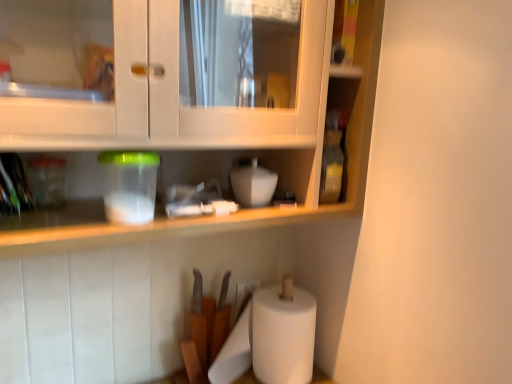
Question: Can you confirm if white matte bowl at center, acting as the 2th appliance starting from the front, is taller than translucent plastic container at upper left, which ranks as the first appliance in left-to-right order?

Choices:
 (A) yes
 (B) no

Answer: (B)

Question: Is the position of white matte bowl at center, which is the first appliance in right-to-left order, less distant than that of translucent plastic container at upper left, which ranks as the first appliance in left-to-right order?

Choices:
 (A) no
 (B) yes

Answer: (A)

Question: Can you confirm if white matte bowl at center, positioned as the 1th appliance in back-to-front order, is shorter than translucent plastic container at upper left, which is the 1th appliance in front-to-back order?

Choices:
 (A) yes
 (B) no

Answer: (A)

Question: Is white matte bowl at center, which is the first appliance in right-to-left order, positioned beyond the bounds of translucent plastic container at upper left, which ranks as the first appliance in left-to-right order?

Choices:
 (A) yes
 (B) no

Answer: (A)

Question: Considering the relative sizes of white matte bowl at center, positioned as the 1th appliance in back-to-front order, and translucent plastic container at upper left, which is the 1th appliance in front-to-back order, in the image provided, is white matte bowl at center, positioned as the 1th appliance in back-to-front order, bigger than translucent plastic container at upper left, which is the 1th appliance in front-to-back order,?

Choices:
 (A) no
 (B) yes

Answer: (A)

Question: From a real-world perspective, is translucent plastic container at upper left, which ranks as the first appliance in left-to-right order, physically above white matte bowl at center, which is the first appliance in right-to-left order?

Choices:
 (A) no
 (B) yes

Answer: (B)

Question: Could you tell me if translucent plastic container at upper left, which is the 1th appliance in front-to-back order, is facing white matte bowl at center, which appears as the second appliance when viewed from the left?

Choices:
 (A) no
 (B) yes

Answer: (A)

Question: From a real-world perspective, is translucent plastic container at upper left, which is the 1th appliance in front-to-back order, located beneath white matte bowl at center, acting as the 2th appliance starting from the front?

Choices:
 (A) no
 (B) yes

Answer: (A)

Question: Is translucent plastic container at upper left, which ranks as the first appliance in left-to-right order, closer to camera compared to white matte bowl at center, acting as the 2th appliance starting from the front?

Choices:
 (A) no
 (B) yes

Answer: (B)

Question: Is translucent plastic container at upper left, the 2th appliance from the back, thinner than white matte bowl at center, which is the first appliance in right-to-left order?

Choices:
 (A) no
 (B) yes

Answer: (A)

Question: Is translucent plastic container at upper left, which is the second appliance in right-to-left order, not within white matte bowl at center, which is the first appliance in right-to-left order?

Choices:
 (A) no
 (B) yes

Answer: (B)

Question: In terms of size, does white matte bowl at center, acting as the 2th appliance starting from the front, appear bigger or smaller than translucent plastic container at upper left, the 2th appliance from the back?

Choices:
 (A) big
 (B) small

Answer: (B)